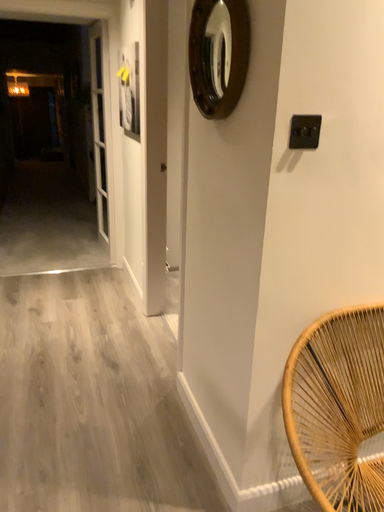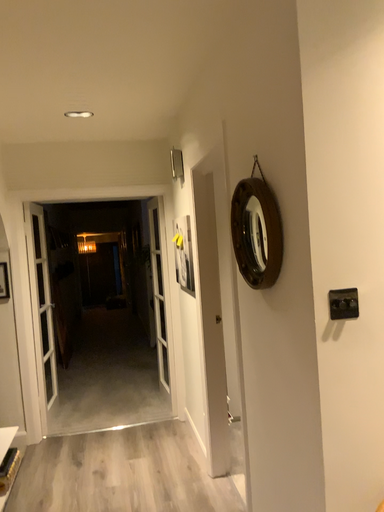
Question: How did the camera likely rotate when shooting the video?

Choices:
 (A) rotated upward
 (B) rotated downward

Answer: (A)